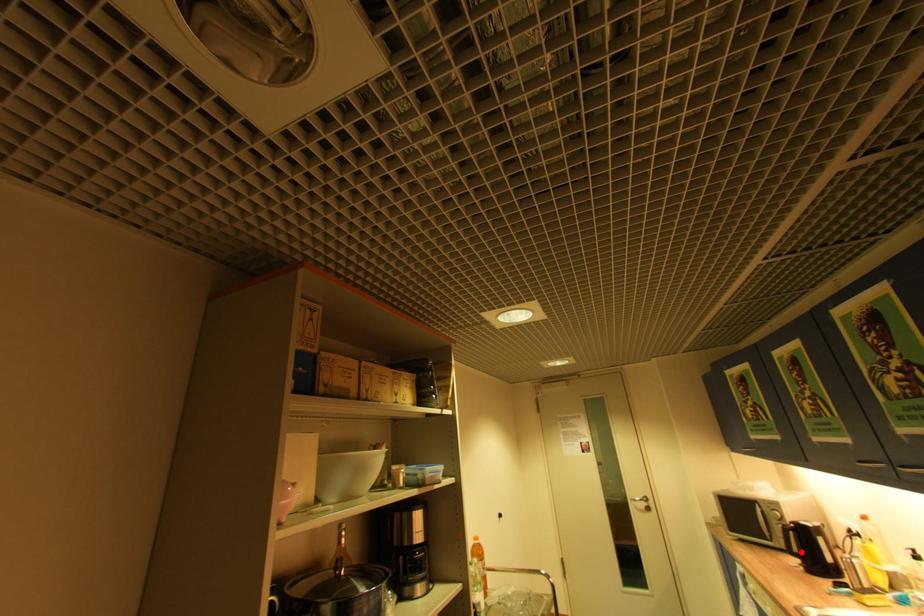
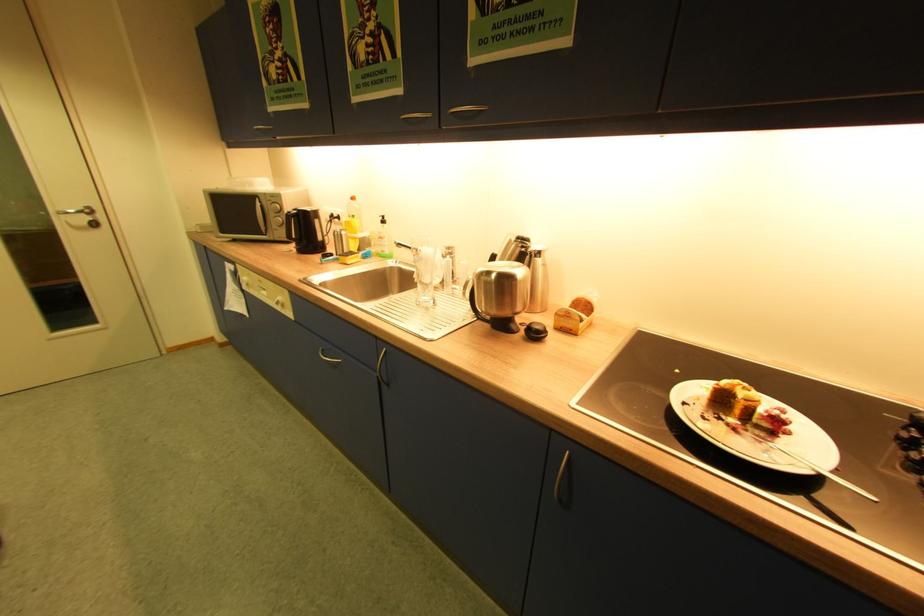
In the second image, find the point that corresponds to the highlighted location in the first image.

(299, 237)